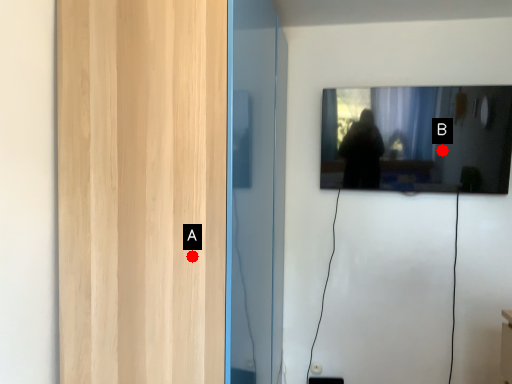
Question: Two points are circled on the image, labeled by A and B beside each circle. Which point is closer to the camera?

Choices:
 (A) A is closer
 (B) B is closer

Answer: (A)